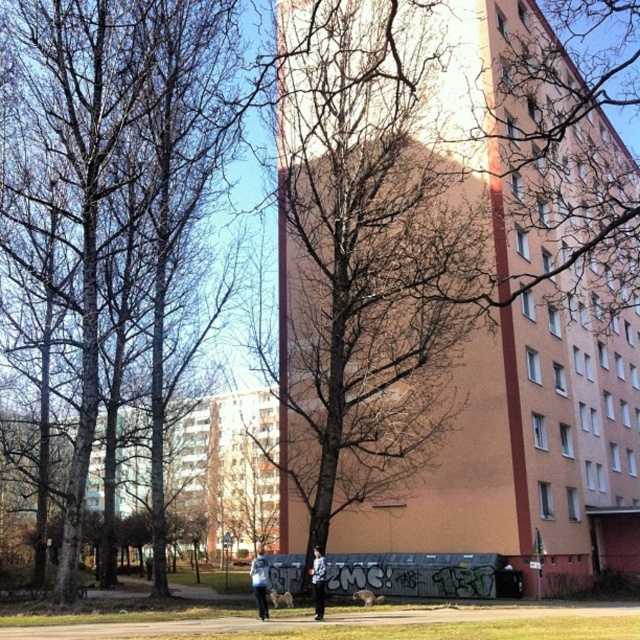
Locate an element on the screen. This screenshot has width=640, height=640. orange matte building at center is located at coordinates (451, 282).

You are a GUI agent. You are given a task and a screenshot of the screen. Output one action in this format:
    pyautogui.click(x=<x>, y=<y>)
    Task: Click on the orange matte building at center
    
    Given the screenshot: What is the action you would take?
    pyautogui.click(x=451, y=282)

Between orange matte building at center and light blue denim jacket at lower center, which one has more height?

orange matte building at center

The width and height of the screenshot is (640, 640). Describe the element at coordinates (451, 282) in the screenshot. I see `orange matte building at center` at that location.

Where is `orange matte building at center`? The width and height of the screenshot is (640, 640). orange matte building at center is located at coordinates (451, 282).

Measure the distance between point (259, 592) and camera.

A distance of 42.73 feet exists between point (259, 592) and camera.

Describe the element at coordinates (259, 582) in the screenshot. I see `light blue fabric jacket at lower center` at that location.

Is point (264, 573) more distant than point (316, 563)?

That is False.

I want to click on light blue fabric jacket at lower center, so click(x=259, y=582).